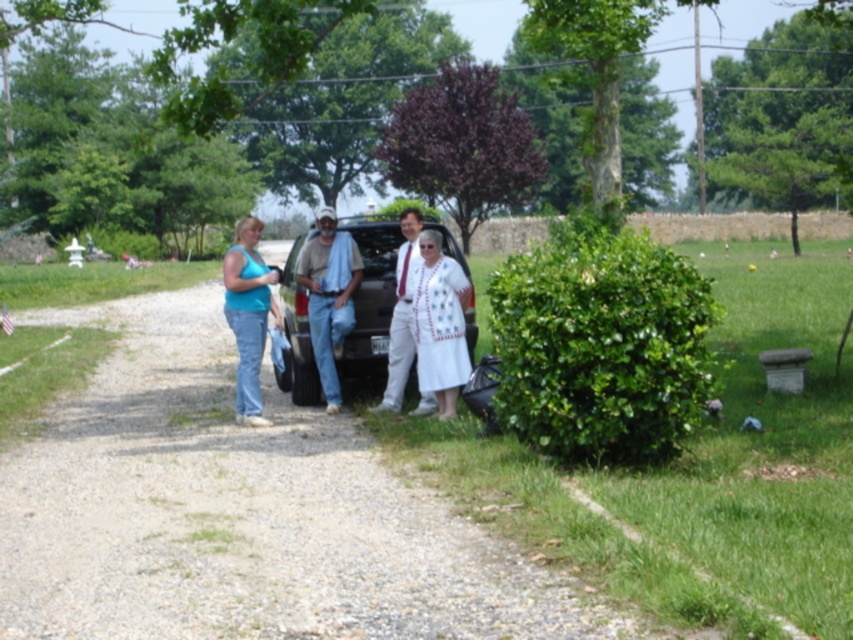
Looking at this image, you are a photographer trying to capture a photo of the group. You notice two points in the scene at coordinates point (440,296) and point (407,326). Which point is positioned closer to your camera lens?

Point (440,296) is closer to the viewer than point (407,326), so the photographer should focus on that point first as it is nearer to the camera lens.

You are a photographer taking a portrait of the matte blue tank top at center and the white cotton shirt at center. Which clothing item should you focus on first if you want to capture the one that is shorter in length?

The matte blue tank top at center is shorter than the white cotton shirt at center, so you should focus on the matte blue tank top at center first.

You are standing in the scene and want to walk from point A to point B. Point A is at coordinate point (260,410) and point B is at coordinate point (393,371). Since you can only move forward, will you need to walk towards or away from the camera to reach point B from point A?

Point A is further to the viewer than point B. To reach point B from point A, you would need to walk away from the camera towards the background.